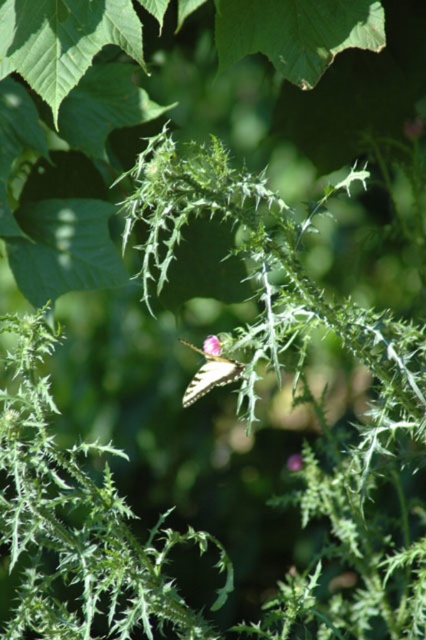
You are a gardener observing the plant. You notice the yellow matte butterfly at center and the smooth pink flower at center. Which object is positioned higher up on the plant?

The yellow matte butterfly at center is much taller than the smooth pink flower at center, so it is positioned higher up on the plant.